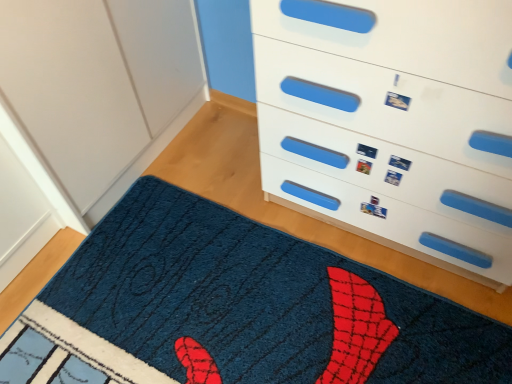
This screenshot has height=384, width=512. What do you see at coordinates (393, 123) in the screenshot?
I see `white plastic chest of drawers at upper right` at bounding box center [393, 123].

Measure the distance between point (476, 3) and camera.

A distance of 27.95 inches exists between point (476, 3) and camera.

Locate an element on the screen. This screenshot has width=512, height=384. white plastic chest of drawers at upper right is located at coordinates (393, 123).

What do you see at coordinates (260, 303) in the screenshot? Image resolution: width=512 pixels, height=384 pixels. I see `blue shaggy mat at lower center` at bounding box center [260, 303].

The width and height of the screenshot is (512, 384). I want to click on blue shaggy mat at lower center, so click(x=260, y=303).

This screenshot has height=384, width=512. In order to click on white plastic chest of drawers at upper right in this screenshot , I will do `click(393, 123)`.

Considering the relative positions of white plastic chest of drawers at upper right and blue shaggy mat at lower center in the image provided, is white plastic chest of drawers at upper right to the left or to the right of blue shaggy mat at lower center?

In the image, white plastic chest of drawers at upper right appears on the right side of blue shaggy mat at lower center.

Is white plastic chest of drawers at upper right closer to the viewer compared to blue shaggy mat at lower center?

Yes, white plastic chest of drawers at upper right is closer to the viewer.

Which is nearer, (450, 43) or (308, 281)?

Point (450, 43) is positioned closer to the camera compared to point (308, 281).

From the image's perspective, which is above, white plastic chest of drawers at upper right or blue shaggy mat at lower center?

white plastic chest of drawers at upper right appears higher in the image.

In the scene shown: From a real-world perspective, is white plastic chest of drawers at upper right over blue shaggy mat at lower center?

Yes.

Does white plastic chest of drawers at upper right have a greater width compared to blue shaggy mat at lower center?

In fact, white plastic chest of drawers at upper right might be narrower than blue shaggy mat at lower center.

Does white plastic chest of drawers at upper right have a lesser height compared to blue shaggy mat at lower center?

No.

Considering the sizes of objects white plastic chest of drawers at upper right and blue shaggy mat at lower center in the image provided, who is bigger, white plastic chest of drawers at upper right or blue shaggy mat at lower center?

Result: Bigger between the two is white plastic chest of drawers at upper right.

Is white plastic chest of drawers at upper right inside or outside of blue shaggy mat at lower center?

white plastic chest of drawers at upper right cannot be found inside blue shaggy mat at lower center.

Is white plastic chest of drawers at upper right touching blue shaggy mat at lower center?

white plastic chest of drawers at upper right and blue shaggy mat at lower center are not in contact.

Is white plastic chest of drawers at upper right positioned with its back to blue shaggy mat at lower center?

No, white plastic chest of drawers at upper right's orientation is not away from blue shaggy mat at lower center.

Can you tell me how much white plastic chest of drawers at upper right and blue shaggy mat at lower center differ in facing direction?

They differ by 180 degrees in their facing directions.

Measure the distance between white plastic chest of drawers at upper right and blue shaggy mat at lower center.

17.40 inches.

Locate an element on the screen. The width and height of the screenshot is (512, 384). mat that is behind the white plastic chest of drawers at upper right is located at coordinates (260, 303).

Considering the relative positions of blue shaggy mat at lower center and white plastic chest of drawers at upper right in the image provided, is blue shaggy mat at lower center to the right of white plastic chest of drawers at upper right from the viewer's perspective?

No.

Which object is closer to the camera, blue shaggy mat at lower center or white plastic chest of drawers at upper right?

white plastic chest of drawers at upper right is in front.

Is point (228, 229) behind point (413, 62)?

Yes, it is.

From the image's perspective, is blue shaggy mat at lower center located above or below white plastic chest of drawers at upper right?

blue shaggy mat at lower center is situated lower than white plastic chest of drawers at upper right in the image.

From a real-world perspective, which object stands above the other?

From a 3D spatial view, white plastic chest of drawers at upper right is above.

Between blue shaggy mat at lower center and white plastic chest of drawers at upper right, which one has larger width?

blue shaggy mat at lower center is wider.

Is blue shaggy mat at lower center taller than white plastic chest of drawers at upper right?

No, blue shaggy mat at lower center is not taller than white plastic chest of drawers at upper right.

Between blue shaggy mat at lower center and white plastic chest of drawers at upper right, which one has larger size?

Bigger between the two is white plastic chest of drawers at upper right.

Is blue shaggy mat at lower center located outside white plastic chest of drawers at upper right?

blue shaggy mat at lower center is positioned outside white plastic chest of drawers at upper right.

Is blue shaggy mat at lower center not close to white plastic chest of drawers at upper right?

No, blue shaggy mat at lower center is not far from white plastic chest of drawers at upper right.

Could you tell me if blue shaggy mat at lower center is turned towards white plastic chest of drawers at upper right?

Yes, blue shaggy mat at lower center is oriented towards white plastic chest of drawers at upper right.

Can you tell me how much blue shaggy mat at lower center and white plastic chest of drawers at upper right differ in facing direction?

180 degrees separate the facing orientations of blue shaggy mat at lower center and white plastic chest of drawers at upper right.

How much distance is there between blue shaggy mat at lower center and white plastic chest of drawers at upper right?

blue shaggy mat at lower center and white plastic chest of drawers at upper right are 17.40 inches apart.

In order to click on mat beneath the white plastic chest of drawers at upper right (from a real-world perspective) in this screenshot , I will do `click(260, 303)`.

Locate an element on the screen. This screenshot has height=384, width=512. mat to the left of white plastic chest of drawers at upper right is located at coordinates (260, 303).

Find the location of a particular element. Image resolution: width=512 pixels, height=384 pixels. mat below the white plastic chest of drawers at upper right (from a real-world perspective) is located at coordinates (260, 303).